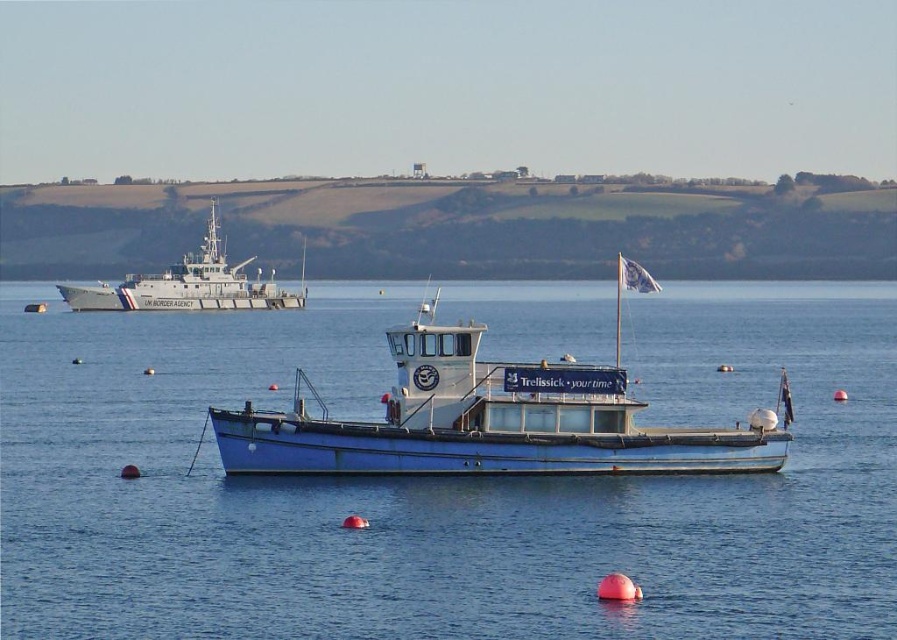
Does blue metallic boat at center have a larger size compared to blue matte boat at center?

Yes.

Can you confirm if blue metallic boat at center is positioned to the right of blue matte boat at center?

In fact, blue metallic boat at center is to the left of blue matte boat at center.

Is point (793, 465) in front of point (504, 378)?

That is False.

In order to click on blue metallic boat at center in this screenshot , I will do pos(441,483).

Which is behind, point (384, 364) or point (206, 252)?

The point (206, 252) is behind.

Does blue metallic boat at center appear over gray metallic ship at upper left?

Incorrect, blue metallic boat at center is not positioned above gray metallic ship at upper left.

Who is more forward, (761, 365) or (184, 272)?

Point (761, 365) is more forward.

The height and width of the screenshot is (640, 897). I want to click on blue metallic boat at center, so click(441, 483).

Is point (519, 388) closer to camera compared to point (280, 300)?

Yes.

Image resolution: width=897 pixels, height=640 pixels. Describe the element at coordinates (489, 420) in the screenshot. I see `blue matte boat at center` at that location.

The width and height of the screenshot is (897, 640). In order to click on blue matte boat at center in this screenshot , I will do `click(489, 420)`.